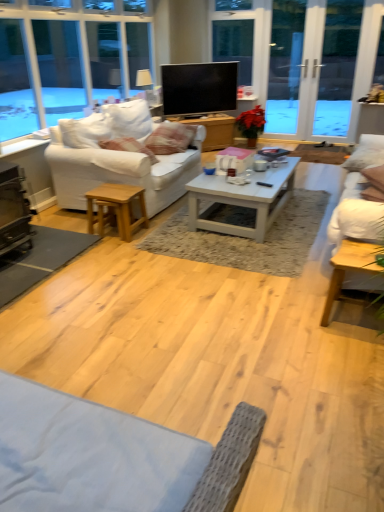
Question: Is flat screen tv at center not inside green matte poinsettia at center?

Choices:
 (A) no
 (B) yes

Answer: (B)

Question: Is flat screen tv at center bigger than green matte poinsettia at center?

Choices:
 (A) yes
 (B) no

Answer: (B)

Question: Does flat screen tv at center have a lesser width compared to green matte poinsettia at center?

Choices:
 (A) no
 (B) yes

Answer: (B)

Question: Does flat screen tv at center contain green matte poinsettia at center?

Choices:
 (A) yes
 (B) no

Answer: (B)

Question: From the image's perspective, is flat screen tv at center under green matte poinsettia at center?

Choices:
 (A) yes
 (B) no

Answer: (B)

Question: Looking at their shapes, would you say black metal fireplace at lower left is wider or thinner than green matte poinsettia at center?

Choices:
 (A) wide
 (B) thin

Answer: (B)

Question: Is black metal fireplace at lower left inside or outside of green matte poinsettia at center?

Choices:
 (A) inside
 (B) outside

Answer: (B)

Question: From a real-world perspective, relative to green matte poinsettia at center, is black metal fireplace at lower left vertically above or below?

Choices:
 (A) above
 (B) below

Answer: (A)

Question: Considering the positions of point (6, 216) and point (258, 116), is point (6, 216) closer or farther from the camera than point (258, 116)?

Choices:
 (A) farther
 (B) closer

Answer: (B)

Question: Looking at the image, does white fabric couch at left, which is counted as the 1th studio couch, starting from the left, seem bigger or smaller compared to white painted wood coffee table at center, which ranks as the first table in back-to-front order?

Choices:
 (A) small
 (B) big

Answer: (B)

Question: From their relative heights in the image, would you say white fabric couch at left, placed as the second studio couch when sorted from right to left, is taller or shorter than white painted wood coffee table at center, placed as the 2th table when sorted from bottom to top?

Choices:
 (A) tall
 (B) short

Answer: (A)

Question: Based on their positions, is white fabric couch at left, which is counted as the 1th studio couch, starting from the left, located to the left or right of white painted wood coffee table at center, which ranks as the first table in back-to-front order?

Choices:
 (A) right
 (B) left

Answer: (B)

Question: From a real-world perspective, is white fabric couch at left, placed as the second studio couch when sorted from right to left, positioned above or below white painted wood coffee table at center, which ranks as the first table in back-to-front order?

Choices:
 (A) below
 (B) above

Answer: (B)

Question: Considering the positions of point (291, 110) and point (87, 172), is point (291, 110) closer or farther from the camera than point (87, 172)?

Choices:
 (A) closer
 (B) farther

Answer: (B)

Question: Visually, is transparent glass screen door at upper right, the 1th screen door from the left, positioned to the left or to the right of white fabric couch at left, placed as the second studio couch when sorted from right to left?

Choices:
 (A) left
 (B) right

Answer: (B)